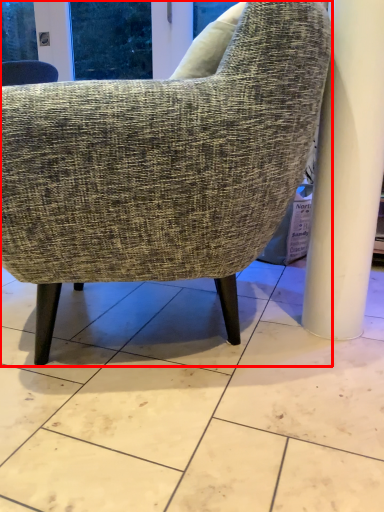
Question: From the image's perspective, what is the correct spatial relationship of chair (annotated by the red box) in relation to concrete?

Choices:
 (A) above
 (B) below

Answer: (A)